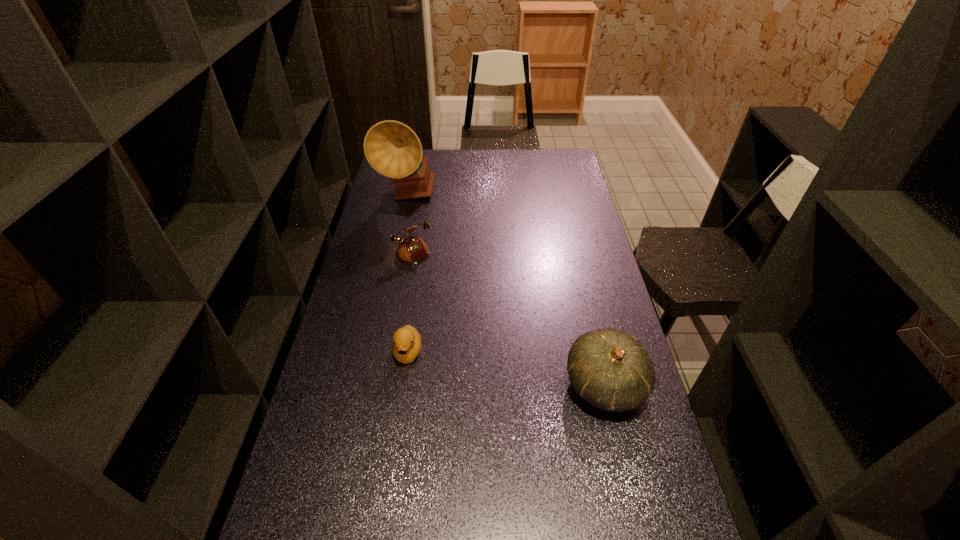
At what (x,y) coordinates should I click in order to perform the action: click on vacant space located on the rotary dial of the third nearest object. Please return your answer as a coordinate pair (x, y). Looking at the image, I should click on (430, 305).

You are a GUI agent. You are given a task and a screenshot of the screen. Output one action in this format:
    pyautogui.click(x=<x>, y=<y>)
    Task: Click on the free space located 0.400m on the horn of the farthest object
    
    Given the screenshot: What is the action you would take?
    pyautogui.click(x=456, y=270)

The image size is (960, 540). In order to click on free location located on the horn of the farthest object in this screenshot , I will do `click(440, 246)`.

This screenshot has height=540, width=960. I want to click on free space located on the horn of the farthest object, so coord(449,260).

Where is `telephone that is at the left edge`? This screenshot has width=960, height=540. telephone that is at the left edge is located at coordinates [413, 250].

Identify the location of phonograph record that is at the left edge. (393, 149).

You are a GUI agent. You are given a task and a screenshot of the screen. Output one action in this format:
    pyautogui.click(x=<x>, y=<y>)
    Task: Click on the object that is at the right edge
    The width and height of the screenshot is (960, 540).
    Given the screenshot: What is the action you would take?
    pyautogui.click(x=611, y=370)

Image resolution: width=960 pixels, height=540 pixels. In order to click on vacant space at the far edge of the desktop in this screenshot , I will do `click(512, 173)`.

Locate an element on the screen. Image resolution: width=960 pixels, height=540 pixels. free spot at the near edge of the desktop is located at coordinates (492, 534).

Identify the location of vacant space at the left edge of the desktop. (341, 346).